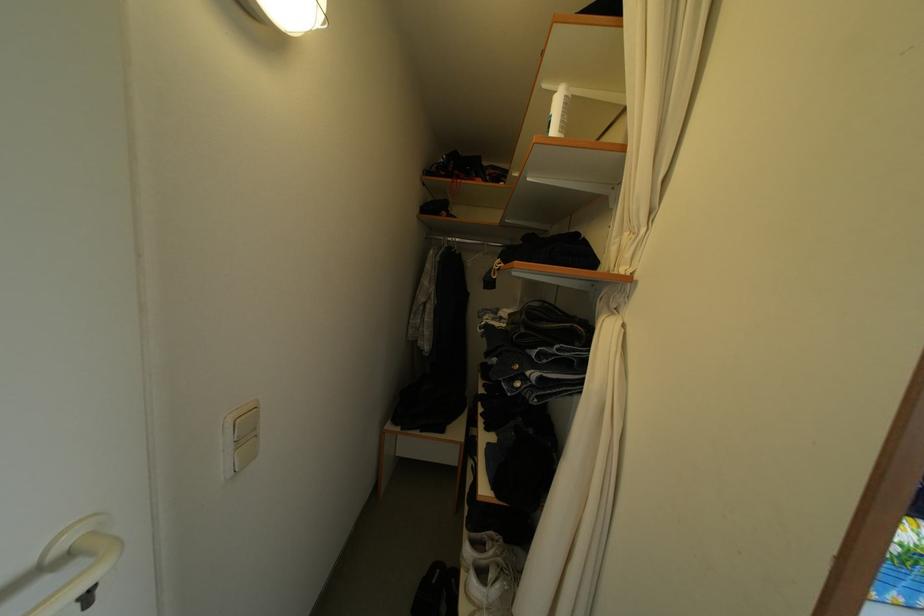
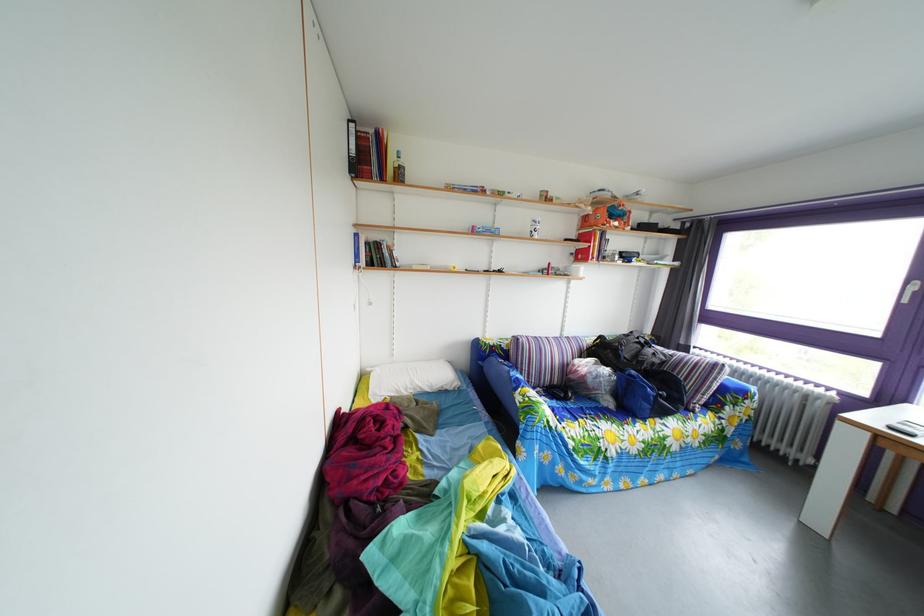
Question: In a continuous first-person perspective shot, in which direction is the camera moving?

Choices:
 (A) Left
 (B) Right
 (C) Forward
 (D) Backward

Answer: (B)